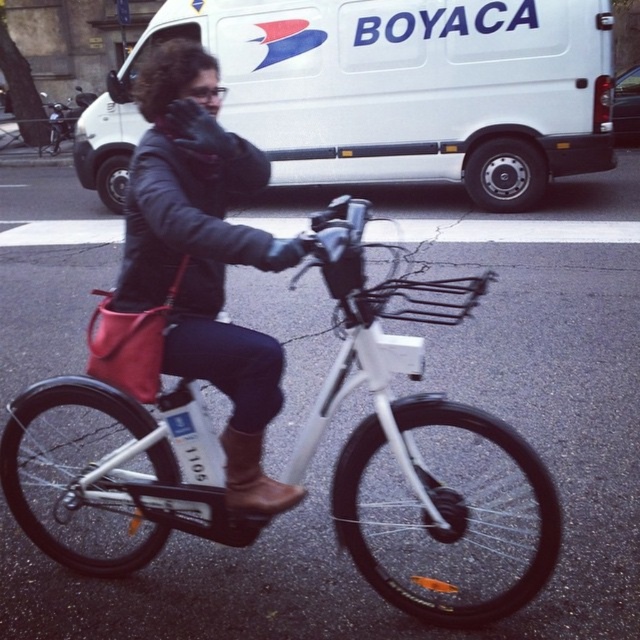
You are a fashion designer observing a cyclist in an urban setting. You notice the cyclist is wearing a leather jacket at center and a brown leather boot at center. Which piece of clothing do you think would require more fabric to create?

The leather jacket at center requires more fabric because it has a larger size compared to the brown leather boot at center.

Consider the image. You are a pedestrian standing at the edge of the street where the white matte bicycle at center and the leather jacket at center are located. Which object is closer to the street edge?

The white matte bicycle at center is closer to the street edge because it is positioned to the left of the leather jacket at center, implying it is nearer to the edge compared to the jacket.

You are a pedestrian standing at the edge of the street. You see the white matte bicycle at center and the leather jacket at center. Which object is closer to the ground?

The white matte bicycle at center is located below the leather jacket at center, so it is closer to the ground.